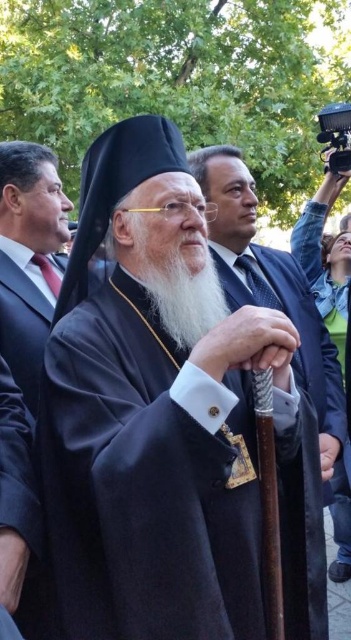
Based on the photo, based on the scene description, which object is positioned lower in the image between the black velvet robe at center and the white matte beard at center?

The black velvet robe at center is positioned below the white matte beard at center, so it is lower in the image.

You are a photographer at this event and need to ensure both the black velvet robe at center and the white matte beard at center are in focus. Given that your camera can only focus on objects within a 10 inch range, will both be in focus?

The black velvet robe at center and the white matte beard at center are 11.10 inches apart from each other, which exceeds the camera focus range of 10 inches. Therefore, both cannot be in focus simultaneously.